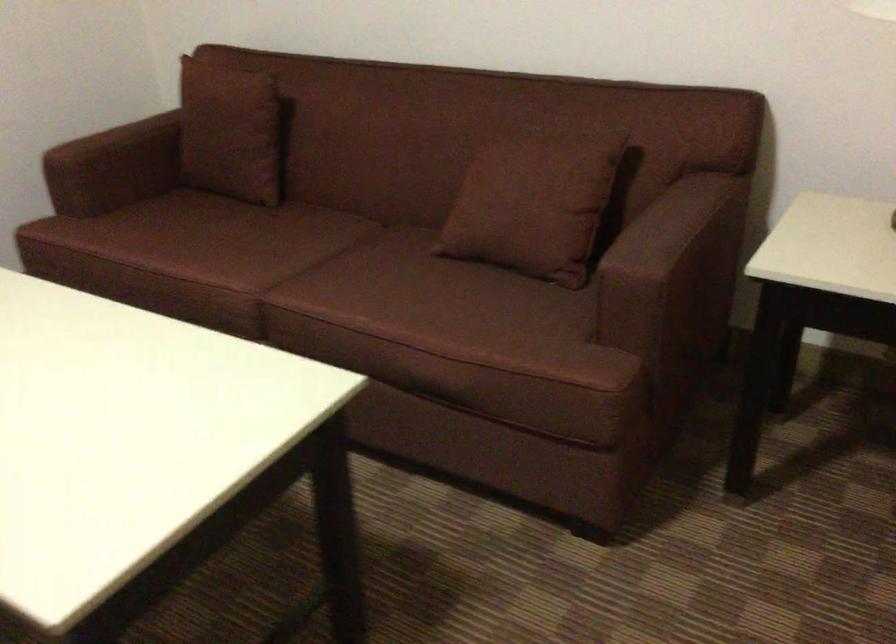
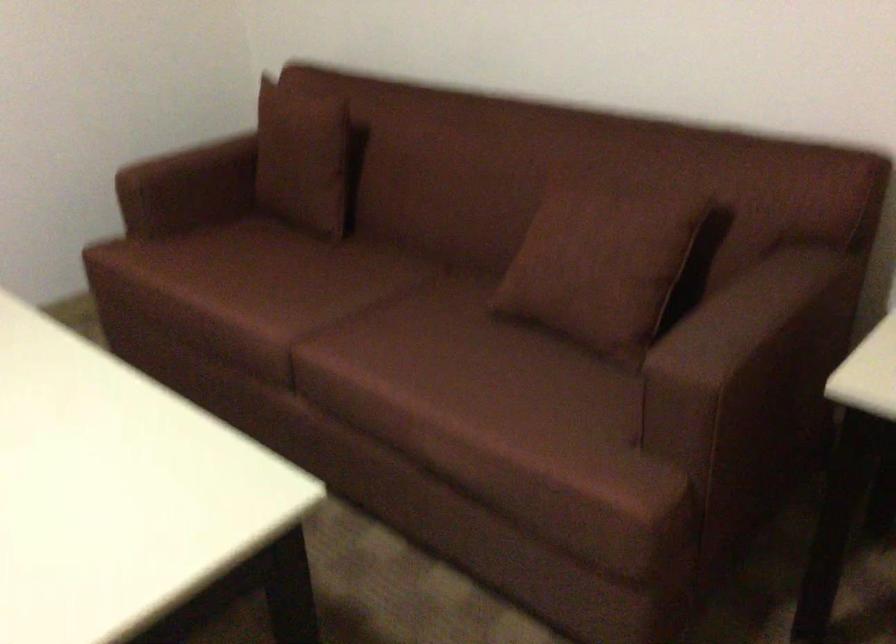
Where in the second image is the point corresponding to the point at 238,128 from the first image?

(306, 158)